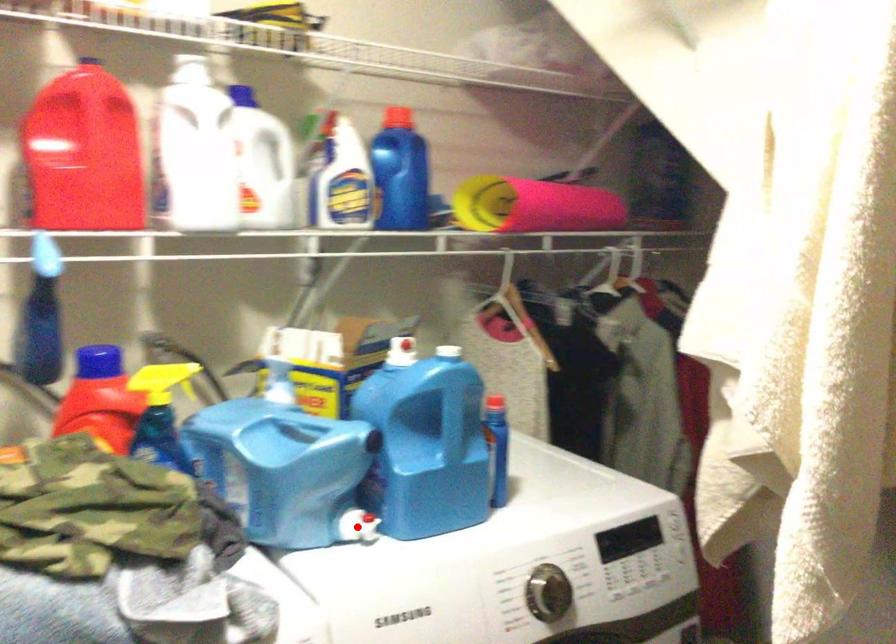
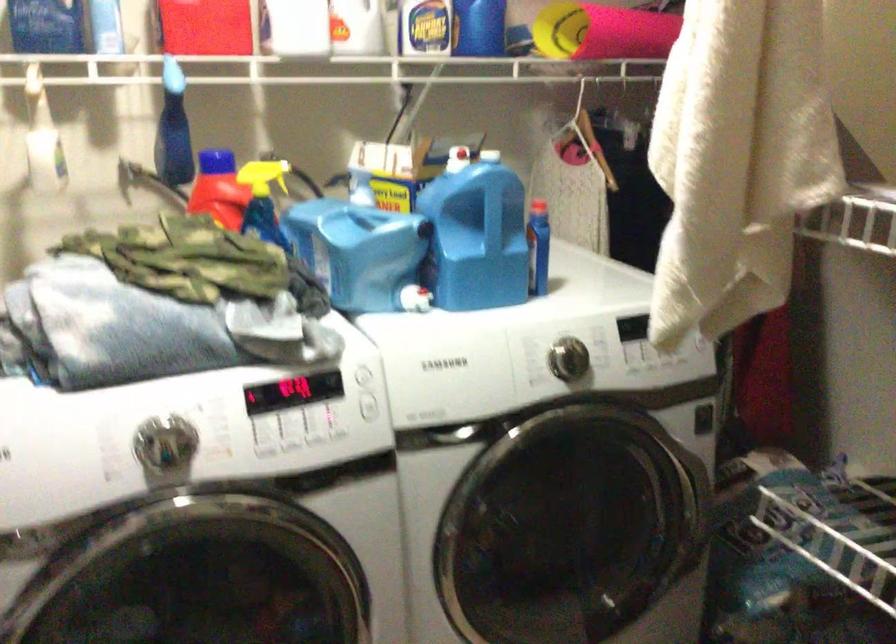
In the second image, find the point that corresponds to the highlighted location in the first image.

(415, 298)